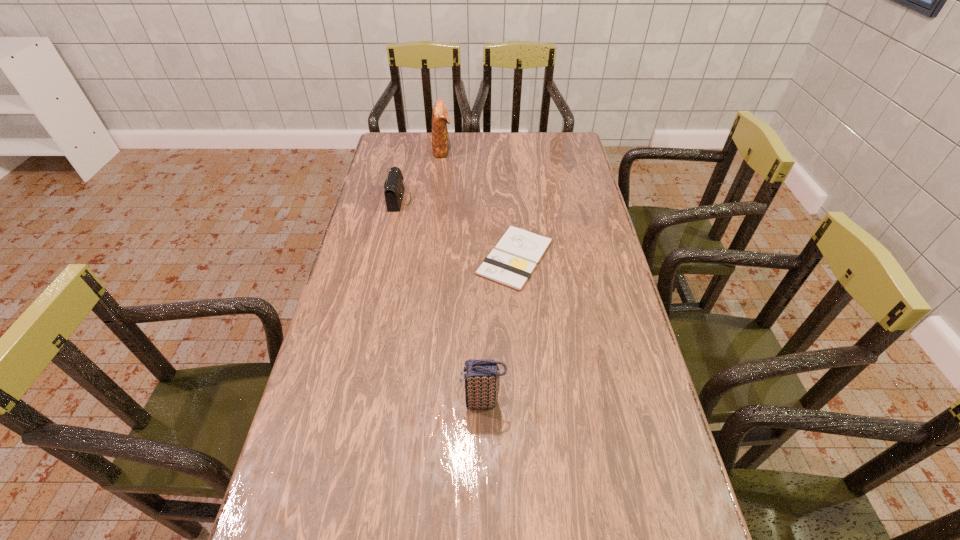
At what (x,y) coordinates should I click in order to perform the action: click on the second object from left to right. Please return your answer as a coordinate pair (x, y). This screenshot has width=960, height=540. Looking at the image, I should click on (440, 118).

In order to click on the second clutch bag from right to left in this screenshot , I will do `click(440, 118)`.

Identify the location of the rightmost clutch bag. (482, 377).

At what (x,y) coordinates should I click in order to perform the action: click on the nearest clutch bag. Please return your answer as a coordinate pair (x, y). This screenshot has width=960, height=540. Looking at the image, I should click on (482, 377).

The image size is (960, 540). Identify the location of the third tallest object. (394, 188).

Locate an element on the screen. the leftmost clutch bag is located at coordinates (394, 188).

Image resolution: width=960 pixels, height=540 pixels. I want to click on the second nearest object, so click(513, 259).

The width and height of the screenshot is (960, 540). I want to click on notepad, so click(513, 259).

The image size is (960, 540). What are the coordinates of `vacant space located 0.270m on the open side of the second clutch bag from left to right` in the screenshot? It's located at (516, 149).

Locate an element on the screen. Image resolution: width=960 pixels, height=540 pixels. free location located 0.300m with the zip open on the rightmost clutch bag is located at coordinates (334, 402).